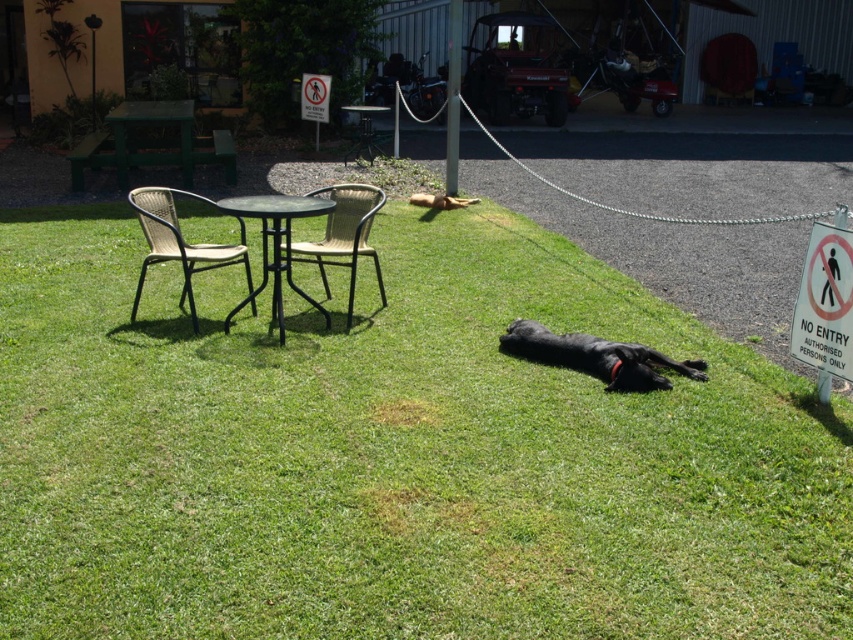
Between black metal table at center and green plastic table at center, which one is positioned higher?

green plastic table at center

Does point (305, 209) come behind point (344, 161)?

No, (305, 209) is in front of (344, 161).

Between point (254, 204) and point (349, 112), which one is positioned behind?

Positioned behind is point (349, 112).

At what (x,y) coordinates should I click in order to perform the action: click on black metal table at center. Please return your answer as a coordinate pair (x, y). Looking at the image, I should click on (276, 244).

Is no entry sign at center right positioned behind white plastic sign at upper center?

No, no entry sign at center right is in front of white plastic sign at upper center.

Is no entry sign at center right shorter than white plastic sign at upper center?

Indeed, no entry sign at center right has a lesser height compared to white plastic sign at upper center.

Is point (834, 282) positioned before point (322, 112)?

Yes, point (834, 282) is closer to viewer.

Locate an element on the screen. The height and width of the screenshot is (640, 853). no entry sign at center right is located at coordinates (825, 301).

Does no entry sign at center right have a larger size compared to green plastic table at upper left?

No.

Consider the image. Can you confirm if no entry sign at center right is shorter than green plastic table at upper left?

Indeed, no entry sign at center right has a lesser height compared to green plastic table at upper left.

Measure the distance between point (834, 310) and camera.

A distance of 4.57 meters exists between point (834, 310) and camera.

The image size is (853, 640). What are the coordinates of `no entry sign at center right` in the screenshot? It's located at 825,301.